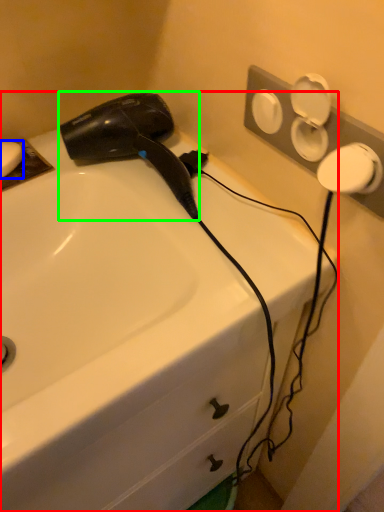
Question: Which is farther away from sink (highlighted by a red box)? soap (highlighted by a blue box) or hair drier (highlighted by a green box)?

Choices:
 (A) soap
 (B) hair drier

Answer: (A)